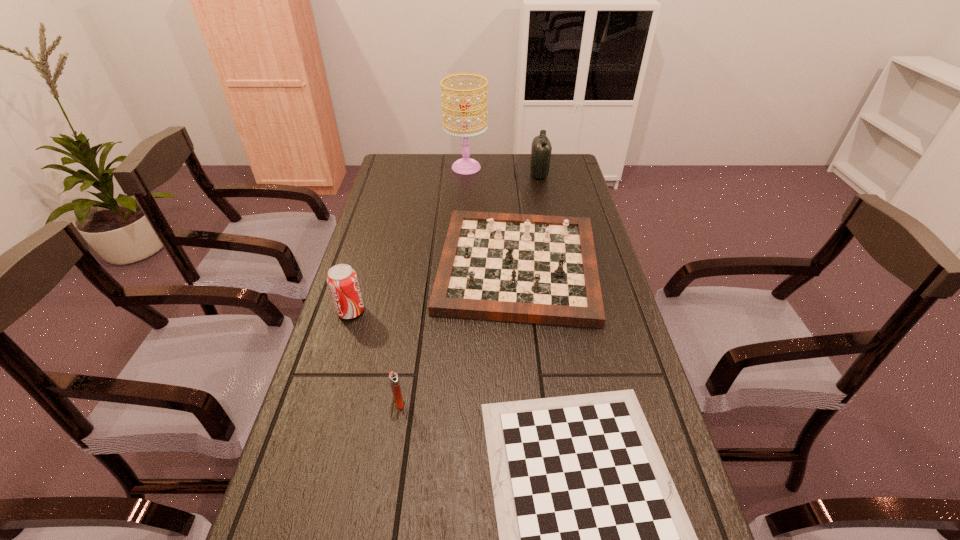
Where is `free space located 0.190m on the left of the farther chessboard`? This screenshot has height=540, width=960. free space located 0.190m on the left of the farther chessboard is located at coordinates (372, 266).

You are a GUI agent. You are given a task and a screenshot of the screen. Output one action in this format:
    pyautogui.click(x=<x>, y=<y>)
    Task: Click on the lampshade that is at the far edge
    This screenshot has width=960, height=540.
    Given the screenshot: What is the action you would take?
    pyautogui.click(x=466, y=165)

Locate an element on the screen. bottle at the far edge is located at coordinates (541, 148).

Find the location of a particular element. The height and width of the screenshot is (540, 960). object that is positioned at the left edge is located at coordinates (342, 280).

You are a GUI agent. You are given a task and a screenshot of the screen. Output one action in this format:
    pyautogui.click(x=<x>, y=<y>)
    Task: Click on the bottle that is at the right edge
    The image size is (960, 540).
    Given the screenshot: What is the action you would take?
    pyautogui.click(x=541, y=148)

Locate an element on the screen. The image size is (960, 540). chessboard at the right edge is located at coordinates (542, 269).

Locate an element on the screen. object located at the far right corner is located at coordinates click(x=541, y=148).

Where is `vacant space at the far edge of the desktop`? The height and width of the screenshot is (540, 960). vacant space at the far edge of the desktop is located at coordinates (498, 158).

Locate an element on the screen. The width and height of the screenshot is (960, 540). vacant region at the left edge is located at coordinates (352, 373).

Find the location of a particular element. This screenshot has height=540, width=960. vacant space at the far left corner is located at coordinates (407, 163).